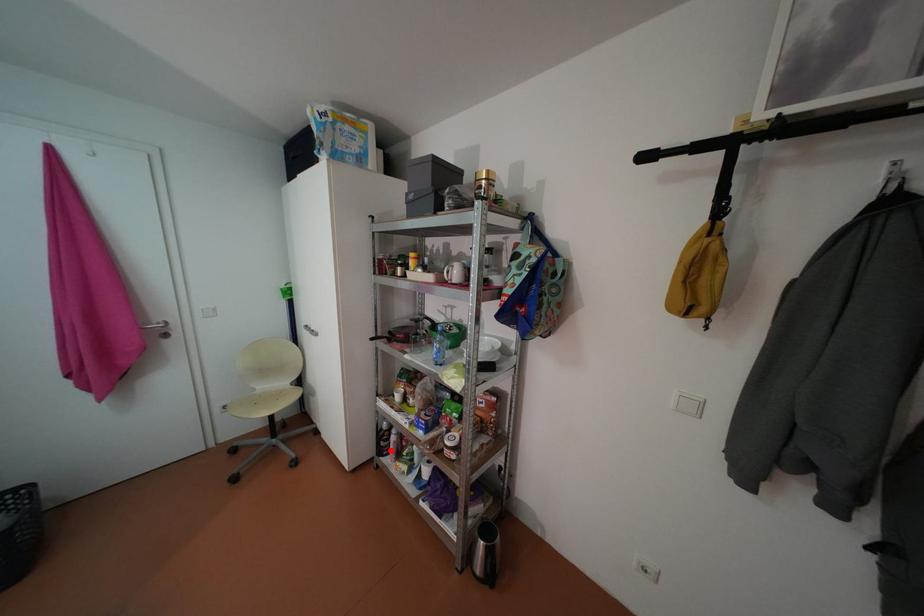
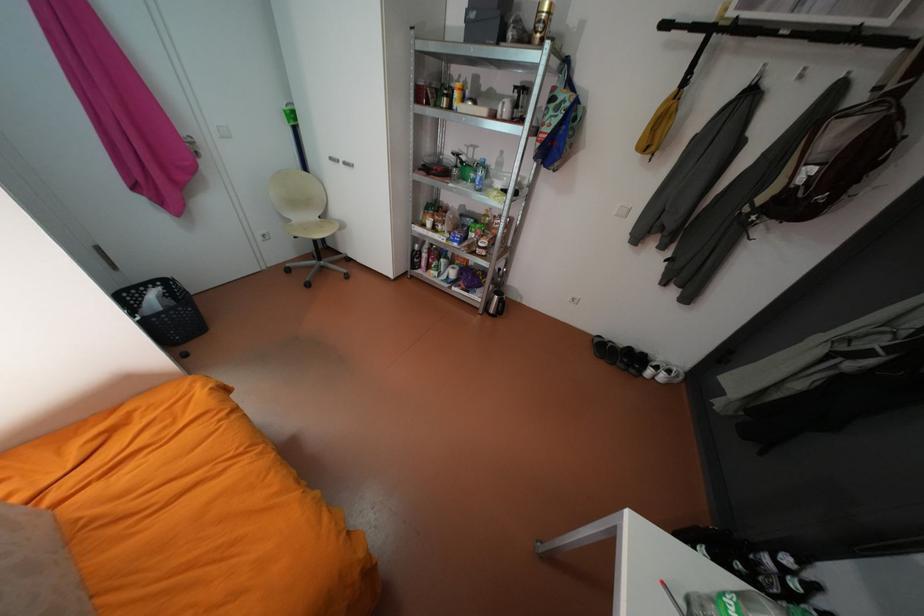
Question: A red point is marked in image1. In image2, is the corresponding 3D point closer to the camera or farther? Reply with the corresponding letter.

Choices:
 (A) The corresponding 3D point is closer.
 (B) The corresponding 3D point is farther.

Answer: (A)